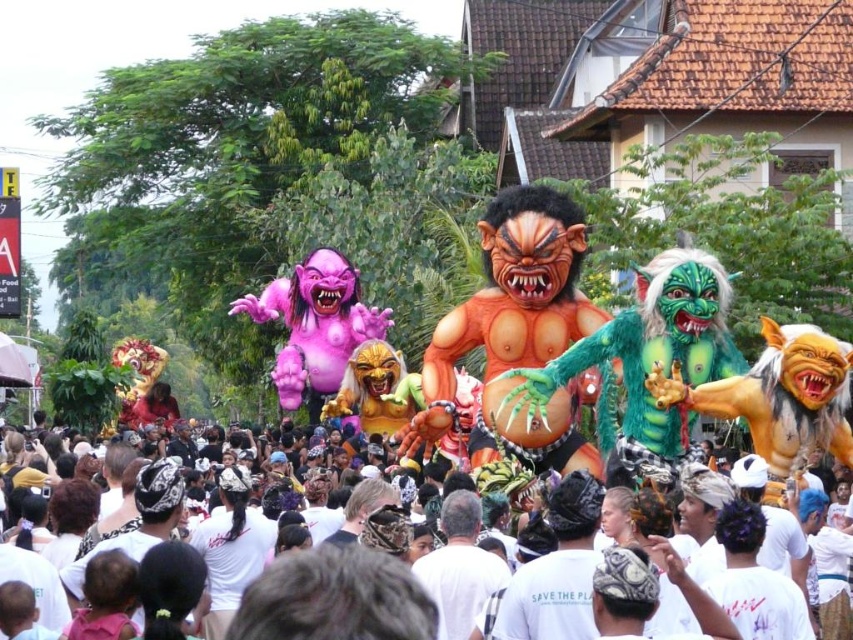
You are a photographer at the parade. You want to capture a photo that includes both the multicolored fabric float at center and the white cotton crowd at center. Which object should you zoom in on to ensure both fit in the frame?

Since the multicolored fabric float at center is narrower than the white cotton crowd at center, you should zoom in on the white cotton crowd at center to ensure both fit in the frame.

You are a photographer standing at the edge of the street. You want to capture a photo that includes both the multicolored fabric float at center and the white cotton crowd at center. Given their distance apart, do you think you can fit both into your camera frame without moving your position?

The multicolored fabric float at center is 25.63 feet away from the white cotton crowd at center. Since the distance between them is significant, you can likely fit both into your camera frame without moving your position as they are spaced apart sufficiently.

You are a photographer positioned at the origin point of the coordinate system. You want to capture the multicolored fabric float at center in your shot. What are the coordinates where you should aim your camera?

The multicolored fabric float at center is located at coordinates point (x=573, y=333), so you should aim your camera at those coordinates to capture it.